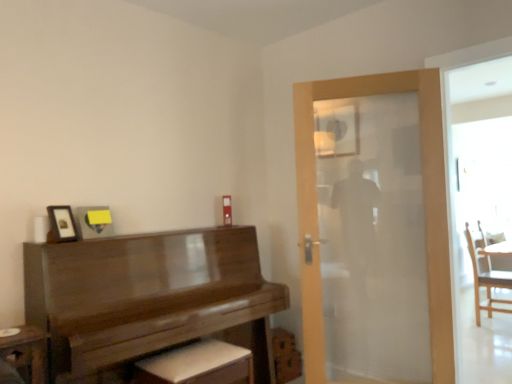
Question: Relative to wooden piano at left, is matte glass mirror at upper center in front or behind?

Choices:
 (A) behind
 (B) front

Answer: (A)

Question: Looking at the image, does matte glass mirror at upper center seem bigger or smaller compared to wooden piano at left?

Choices:
 (A) small
 (B) big

Answer: (A)

Question: Which is farther from the translucent glass door at center?

Choices:
 (A) matte glass mirror at upper center
 (B) wooden piano at left
 (C) white leather footrest at lower center
 (D) matte black picture frame at upper left
 (E) wooden chair at right

Answer: (E)

Question: Estimate the real-world distances between objects in this image. Which object is closer to the wooden chair at right?

Choices:
 (A) wooden piano at left
 (B) translucent glass door at center
 (C) matte black picture frame at upper left
 (D) matte glass mirror at upper center
 (E) white leather footrest at lower center

Answer: (B)